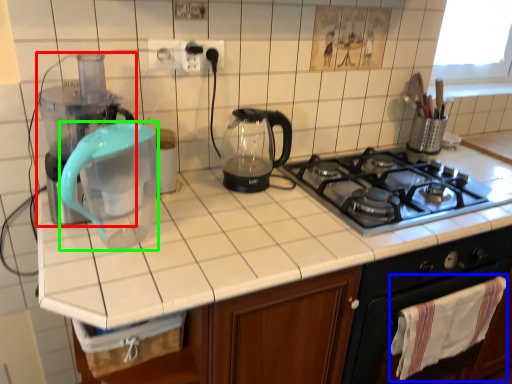
Question: Estimate the real-world distances between objects in this image. Which object is closer to blender (highlighted by a red box), cloth (highlighted by a blue box) or coffeepot (highlighted by a green box)?

Choices:
 (A) cloth
 (B) coffeepot

Answer: (B)